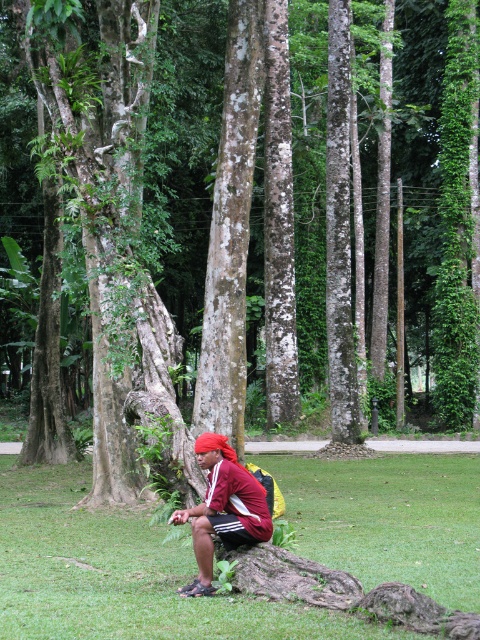
You are standing at the camera position and want to know how far the point at coordinates (36, 518) is from you. Can you determine the distance?

The point at coordinates (36, 518) is 12.03 meters away from the camera position.